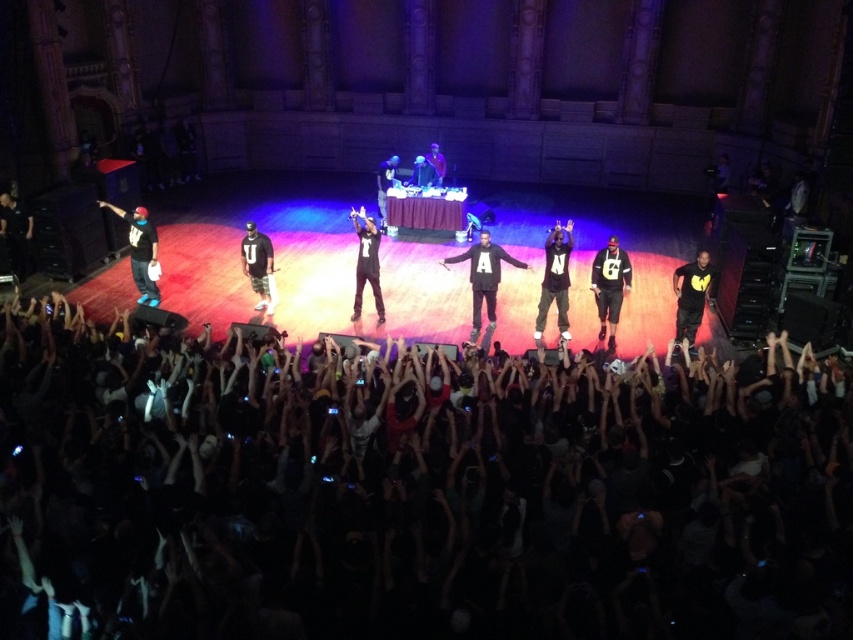
Question: Is matte black hoodie at left to the left of black matte jacket at center from the viewer's perspective?

Choices:
 (A) no
 (B) yes

Answer: (B)

Question: Does black matte jacket at center appear over matte black turntable at center?

Choices:
 (A) yes
 (B) no

Answer: (A)

Question: Is white jersey at center wider than black matte jacket at center?

Choices:
 (A) yes
 (B) no

Answer: (B)

Question: Which point is closer to the camera?

Choices:
 (A) (425, 164)
 (B) (798, 376)
 (C) (386, 180)
 (D) (544, 243)

Answer: (B)

Question: Estimate the real-world distances between objects in this image. Which object is farther from the matte black hoodie at left?

Choices:
 (A) camouflage pants at center
 (B) black fabric crowd at lower center
 (C) black matte pants at center

Answer: (B)

Question: Which point is farther from the camera taking this photo?

Choices:
 (A) (694, 275)
 (B) (476, 291)
 (C) (434, 172)

Answer: (C)